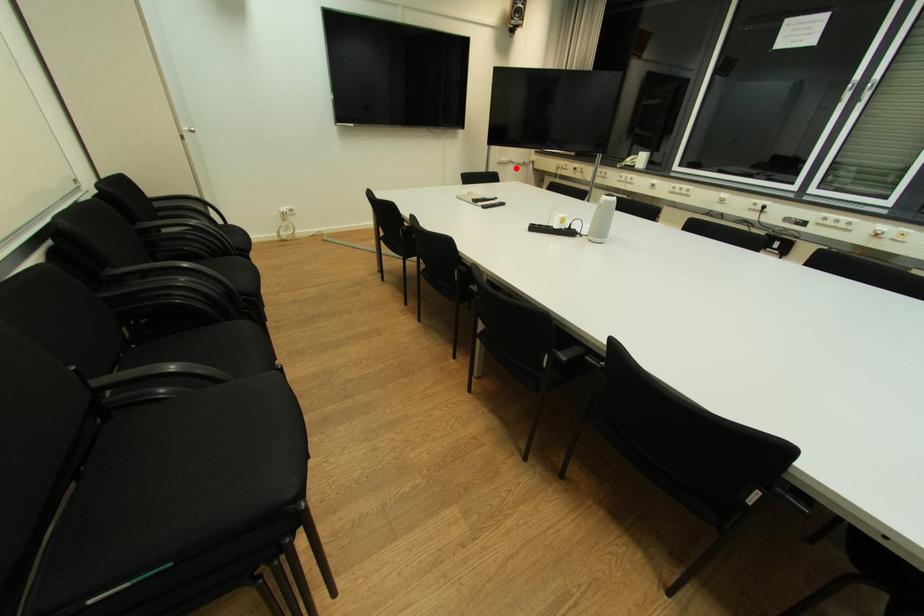
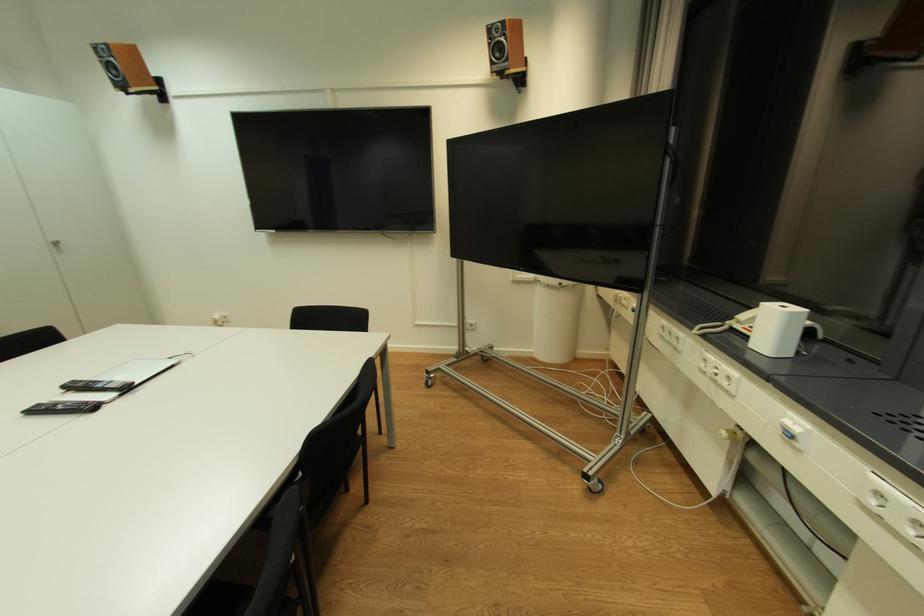
Question: I am providing you with two images of the same scene from different viewpoints. Given a red point in image1, look at the same physical point in image2. Is it:

Choices:
 (A) Closer to the viewpoint
 (B) Farther from the viewpoint

Answer: (A)